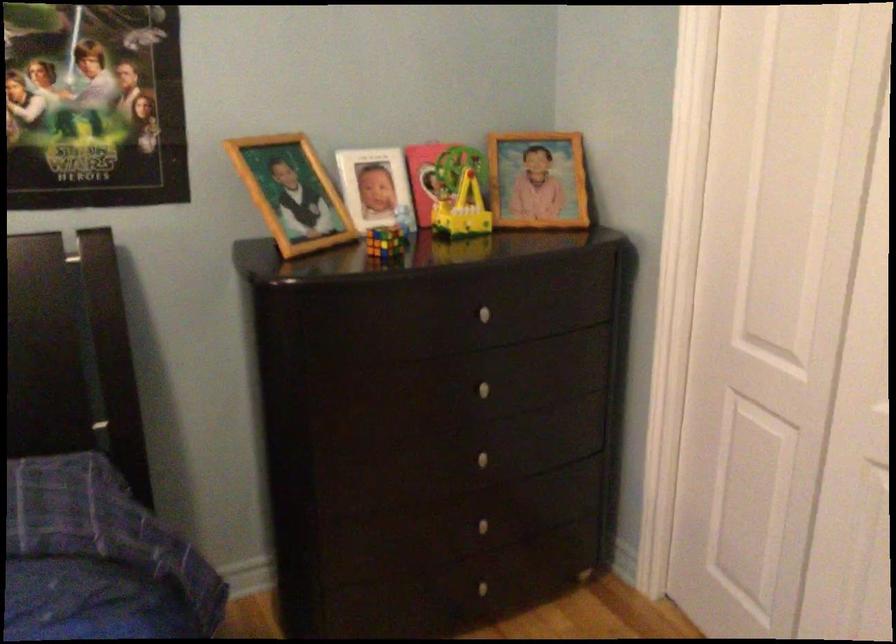
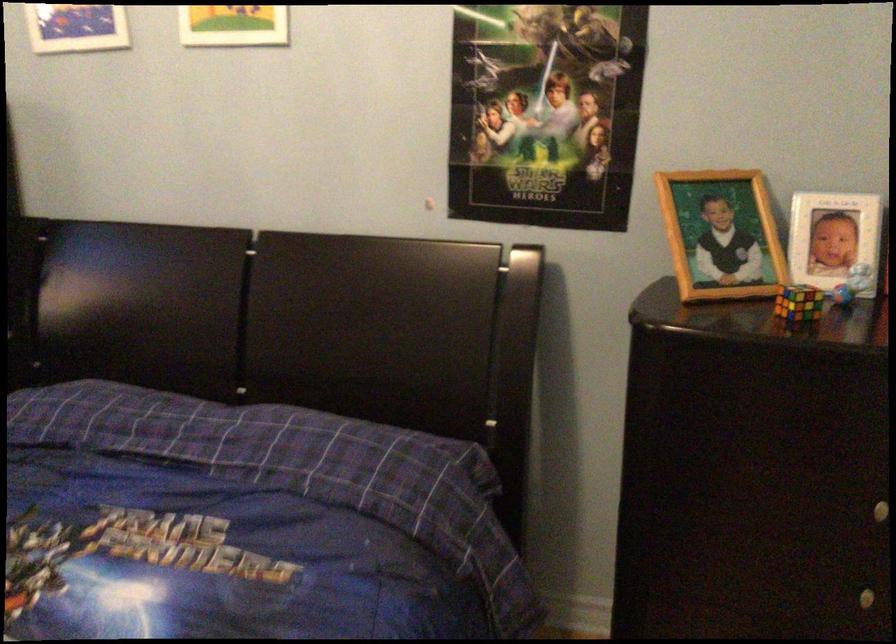
The point at (487, 456) is marked in the first image. Where is the corresponding point in the second image?

(868, 597)